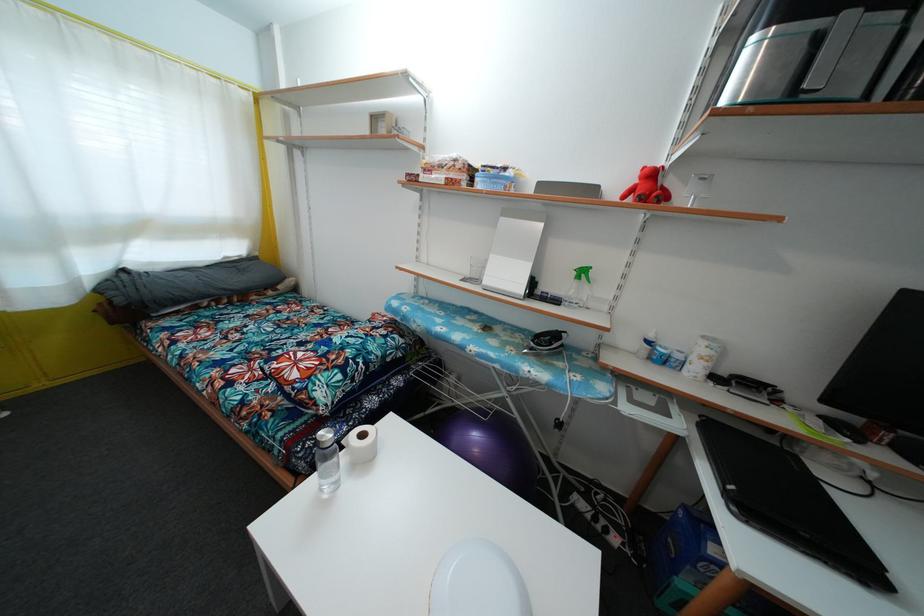
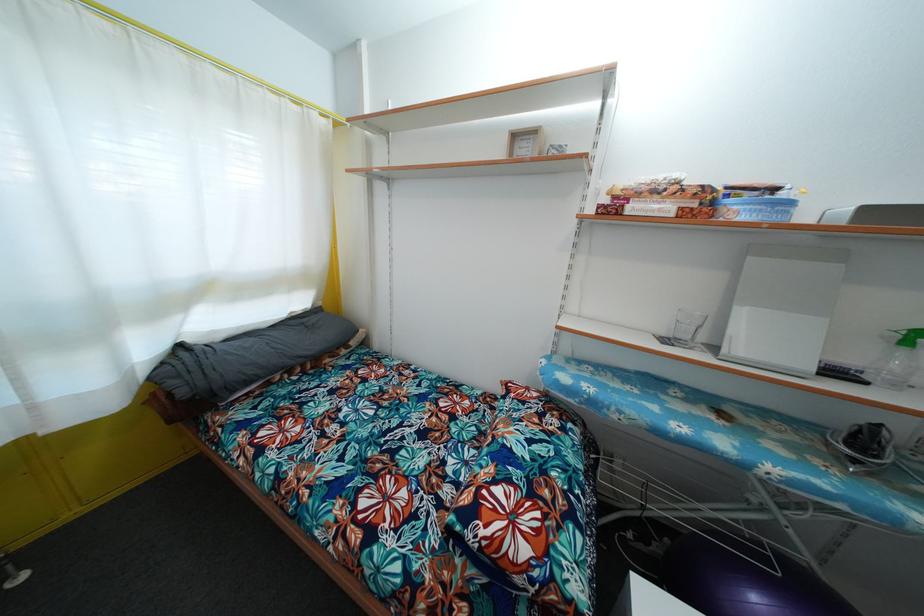
Question: How did the camera likely rotate?

Choices:
 (A) Left
 (B) Right
 (C) Up
 (D) Down

Answer: (C)